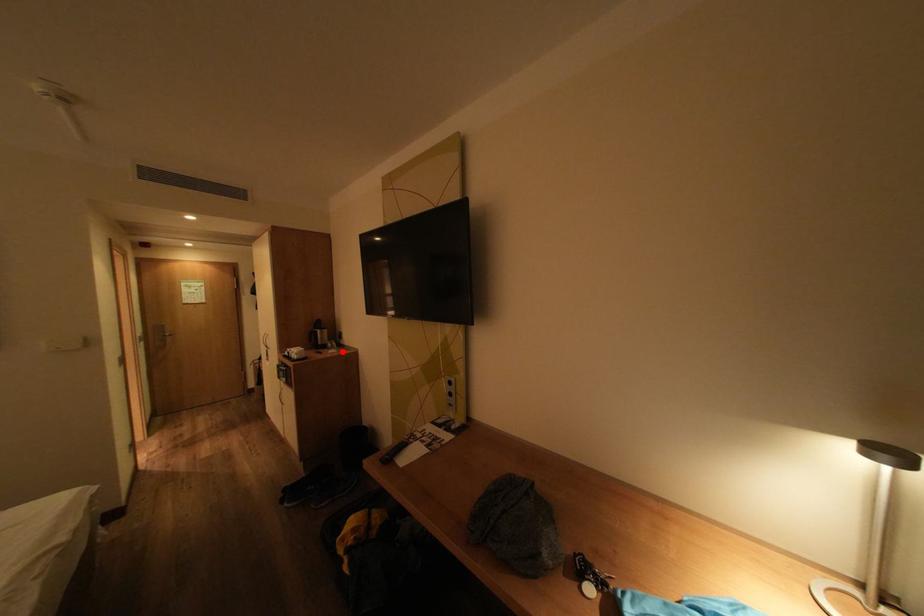
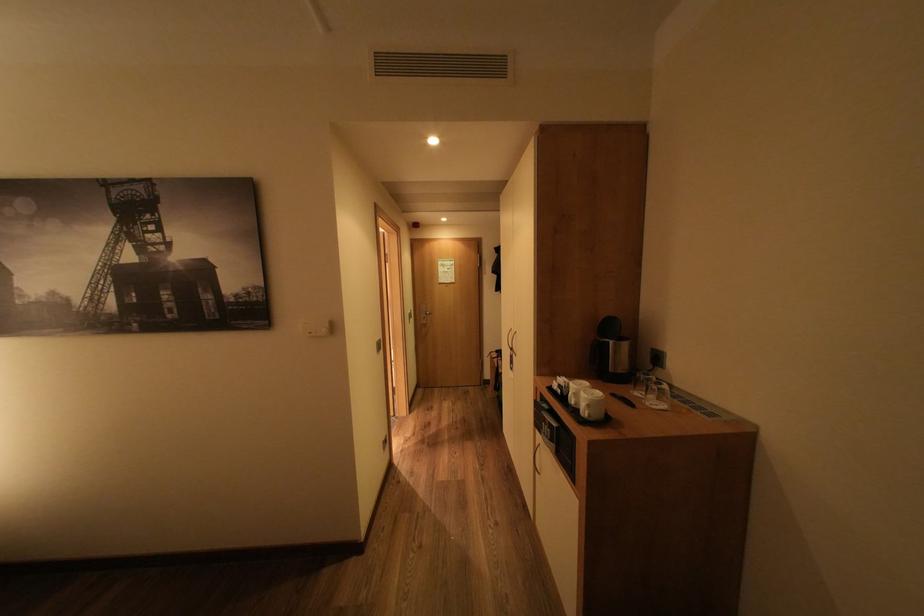
The point at the highlighted location is marked in the first image. Where is the corresponding point in the second image?

(664, 402)